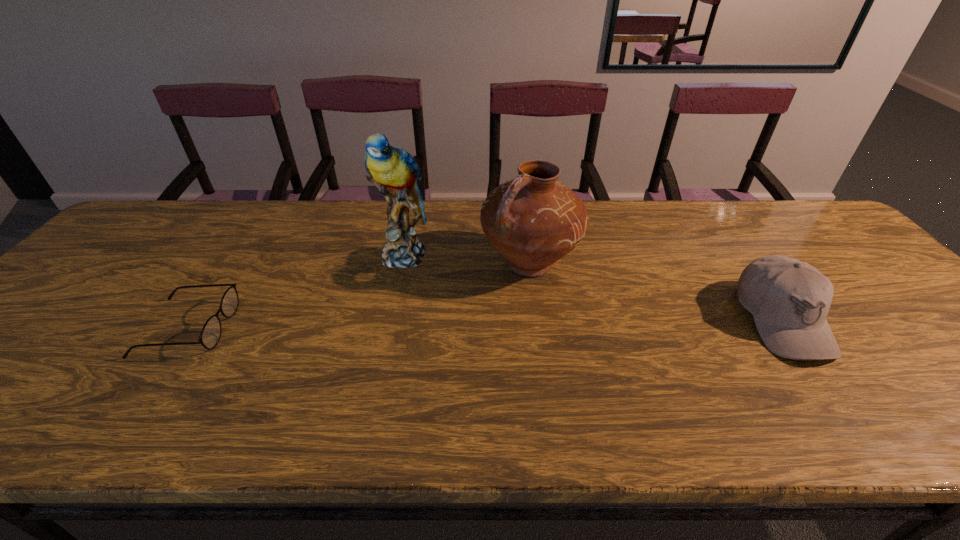
The height and width of the screenshot is (540, 960). In the image, there is a desktop. What are the coordinates of `blank space at the right edge` in the screenshot? It's located at (948, 357).

Identify the location of blank space at the far left corner. The image size is (960, 540). (161, 239).

Where is `unoccupied position between the shortest object and the second object from left to right`? unoccupied position between the shortest object and the second object from left to right is located at coordinates (295, 291).

Where is `free space between the rightmost object and the third object from left to right`? This screenshot has width=960, height=540. free space between the rightmost object and the third object from left to right is located at coordinates (656, 292).

Find the location of a particular element. The width and height of the screenshot is (960, 540). vacant area between the second object from right to left and the rightmost object is located at coordinates (656, 292).

Locate an element on the screen. vacant space in between the third tallest object and the shortest object is located at coordinates (485, 323).

This screenshot has width=960, height=540. I want to click on unoccupied area between the spectacles and the pottery, so click(x=359, y=295).

The image size is (960, 540). I want to click on vacant space that's between the parrot and the baseball cap, so click(x=592, y=287).

Find the location of a particular element. free point between the parrot and the third shortest object is located at coordinates (466, 258).

Where is `vacant area between the leftmost object and the baseball cap`? Image resolution: width=960 pixels, height=540 pixels. vacant area between the leftmost object and the baseball cap is located at coordinates (485, 323).